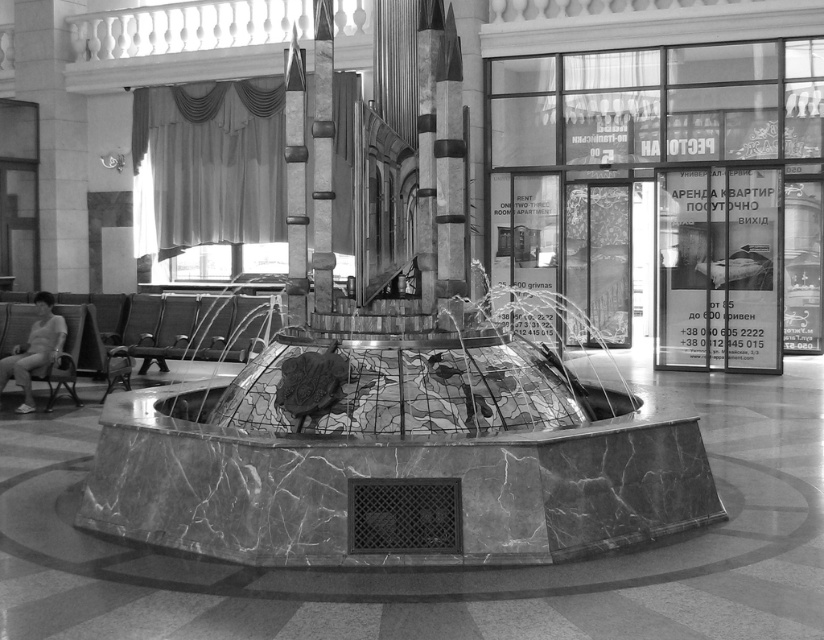
Between polished marble pole at center and marble pole at center, which one has more height?

With more height is marble pole at center.

Between polished marble pole at center and marble pole at center, which one is positioned lower?

polished marble pole at center is lower down.

What do you see at coordinates (425, 148) in the screenshot?
I see `polished marble pole at center` at bounding box center [425, 148].

Where is `polished marble pole at center`? The width and height of the screenshot is (824, 640). polished marble pole at center is located at coordinates (425, 148).